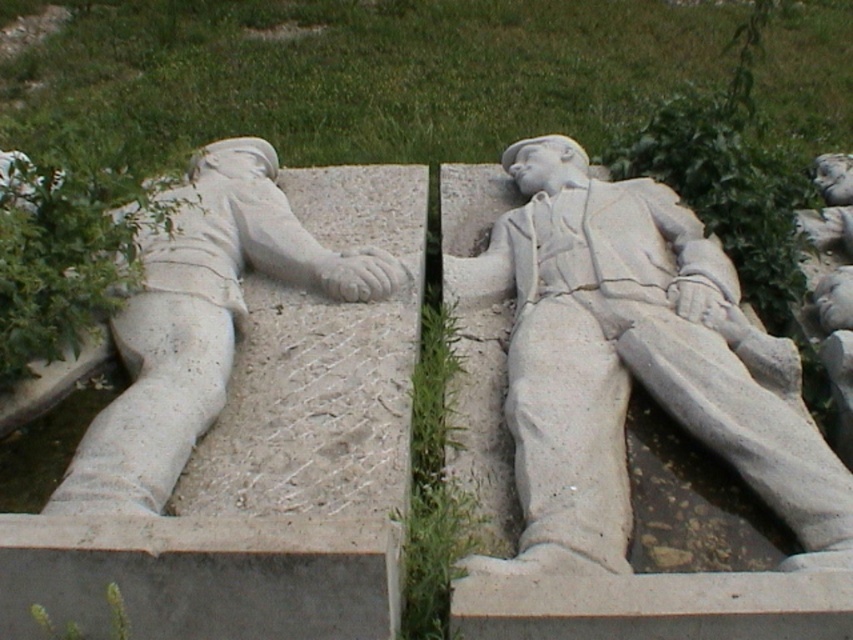
Question: Is white stone statue at center smaller than white stone statue at left?

Choices:
 (A) yes
 (B) no

Answer: (B)

Question: Which object is farther from the camera taking this photo?

Choices:
 (A) white stone statue at center
 (B) white stone statue at left

Answer: (B)

Question: Which point is farther to the camera?

Choices:
 (A) white stone statue at center
 (B) white stone statue at left

Answer: (B)

Question: Does white stone statue at center have a greater width compared to white stone statue at left?

Choices:
 (A) no
 (B) yes

Answer: (B)

Question: Which object appears farthest from the camera in this image?

Choices:
 (A) white stone statue at left
 (B) white stone statue at center

Answer: (A)

Question: Does white stone statue at center appear under white stone statue at left?

Choices:
 (A) yes
 (B) no

Answer: (A)